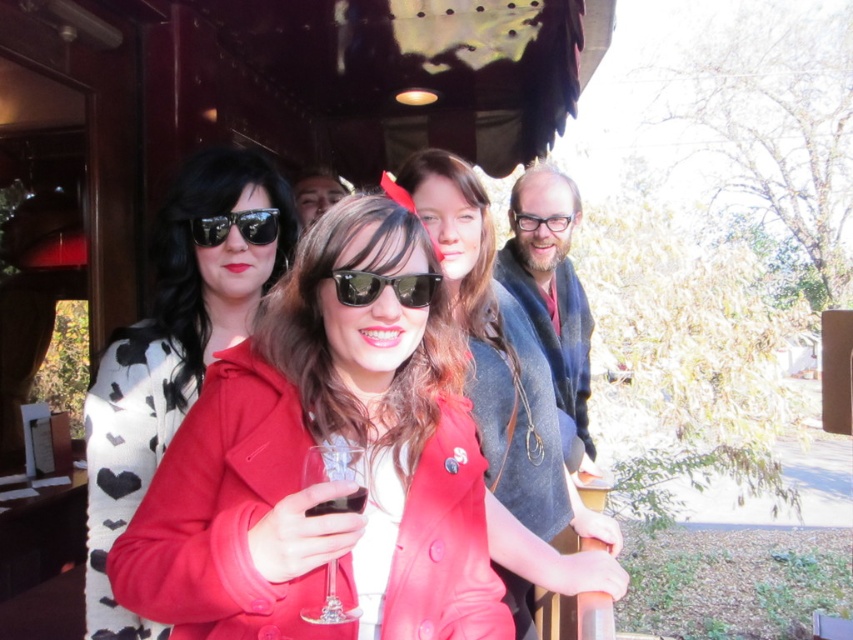
Does clear glass wine glass at center have a lesser height compared to matte black glasses at center?

In fact, clear glass wine glass at center may be taller than matte black glasses at center.

Is clear glass wine glass at center above matte black glasses at center?

Incorrect, clear glass wine glass at center is not positioned above matte black glasses at center.

Which is behind, point (338, 452) or point (541, 224)?

The point (541, 224) is more distant.

I want to click on clear glass wine glass at center, so click(329, 461).

Is point (589, 529) positioned behind point (332, 588)?

Yes, it is.

Who is lower down, matte red coat at center or clear glass wine glass at center?

clear glass wine glass at center is below.

Which is behind, point (503, 328) or point (335, 589)?

The point (503, 328) is behind.

You are a GUI agent. You are given a task and a screenshot of the screen. Output one action in this format:
    pyautogui.click(x=<x>, y=<y>)
    Task: Click on the matte red coat at center
    
    Given the screenshot: What is the action you would take?
    [x=508, y=400]

Between matte black sunglasses at left and sunglasses at center, which one appears on the left side from the viewer's perspective?

Positioned to the left is matte black sunglasses at left.

What do you see at coordinates (173, 353) in the screenshot? I see `matte black sunglasses at left` at bounding box center [173, 353].

The image size is (853, 640). Identify the location of matte black sunglasses at left. (173, 353).